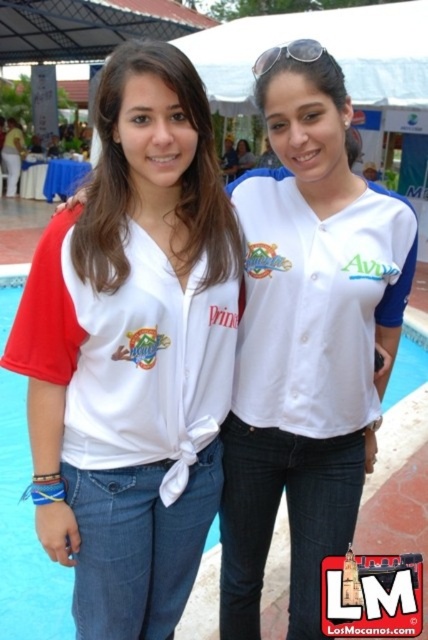
Does blue smooth water at center appear on the right side of silver metallic sunglasses at upper center?

Yes, blue smooth water at center is to the right of silver metallic sunglasses at upper center.

Can you confirm if blue smooth water at center is thinner than silver metallic sunglasses at upper center?

Correct, blue smooth water at center's width is less than silver metallic sunglasses at upper center's.

Image resolution: width=428 pixels, height=640 pixels. Find the location of `blue smooth water at center`. blue smooth water at center is located at coordinates click(x=24, y=538).

Does white jersey at center appear over silver metallic sunglasses at upper center?

Actually, white jersey at center is below silver metallic sunglasses at upper center.

Looking at this image, is white jersey at center positioned in front of silver metallic sunglasses at upper center?

No, it is behind silver metallic sunglasses at upper center.

Does point (350, 296) come farther from viewer compared to point (293, 49)?

That is True.

Find the location of a particular element. Image resolution: width=428 pixels, height=640 pixels. white jersey at center is located at coordinates (317, 304).

Is the position of white jersey at center more distant than that of blue smooth water at center?

That is False.

Describe the element at coordinates (317, 304) in the screenshot. The image size is (428, 640). I see `white jersey at center` at that location.

Does point (258, 360) come in front of point (29, 536)?

That is True.

Where is `white jersey at center`? Image resolution: width=428 pixels, height=640 pixels. white jersey at center is located at coordinates (317, 304).